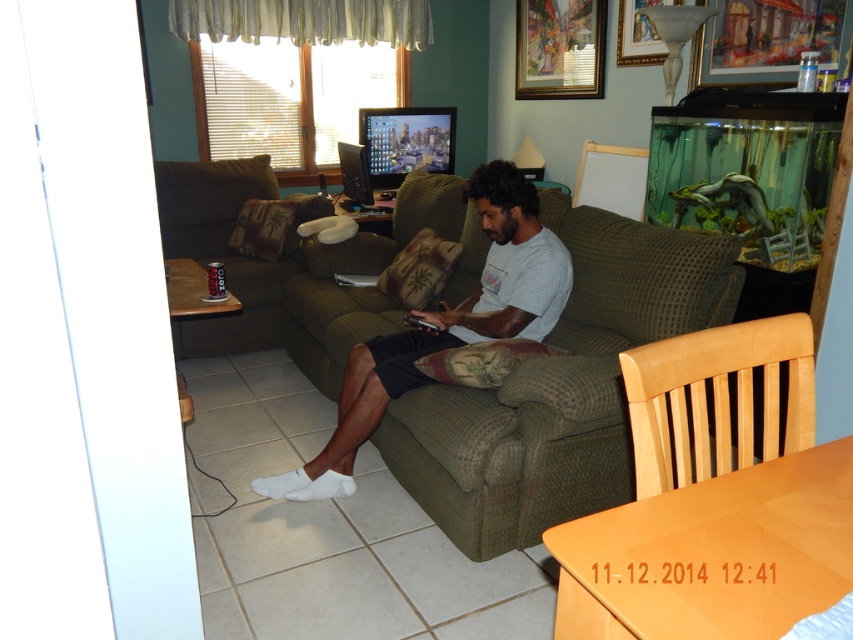
Does light brown wooden chair at lower right appear over green fabric couch at left?

Actually, light brown wooden chair at lower right is below green fabric couch at left.

Does point (722, 380) come behind point (160, 198)?

No.

Between point (809, 371) and point (263, 320), which one is positioned behind?

Positioned behind is point (263, 320).

At what (x,y) coordinates should I click in order to perform the action: click on light brown wooden chair at lower right. Please return your answer as a coordinate pair (x, y). The width and height of the screenshot is (853, 640). Looking at the image, I should click on (717, 400).

Which is above, green fabric couch at center or matte gray shirt at center?

Positioned higher is green fabric couch at center.

Which is behind, point (531, 426) or point (558, 253)?

The point (558, 253) is behind.

Does point (431, 196) come closer to viewer compared to point (317, 492)?

No, it is behind (317, 492).

Image resolution: width=853 pixels, height=640 pixels. What are the coordinates of `green fabric couch at center` in the screenshot? It's located at (558, 387).

Is point (425, 342) positioned after point (247, 337)?

That is False.

Looking at this image, is matte gray shirt at center to the left of green fabric couch at left from the viewer's perspective?

Incorrect, matte gray shirt at center is not on the left side of green fabric couch at left.

Describe the element at coordinates (444, 326) in the screenshot. The image size is (853, 640). I see `matte gray shirt at center` at that location.

Locate an element on the screen. This screenshot has width=853, height=640. matte gray shirt at center is located at coordinates (444, 326).